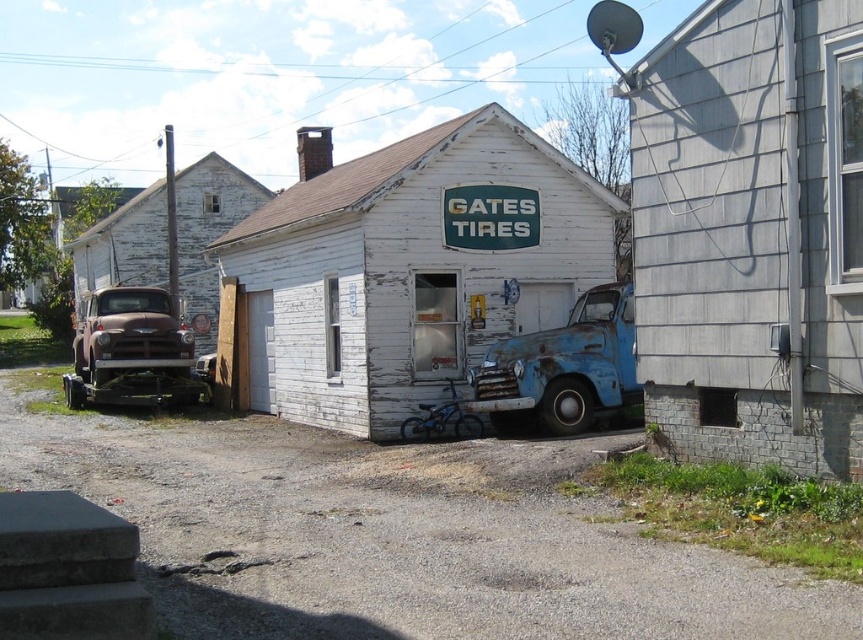
You are a delivery person trying to park your van in the driveway of the abandoned tire shop. The driveway can only accommodate vehicles smaller than the white weathered wood shed at center. Can your van, which is the same size as the rusty metal truck at center, fit in the driveway?

The white weathered wood shed at center is bigger than the rusty metal truck at center. Since your van is the same size as the rusty metal truck at center, it should fit in the driveway as the driveway can accommodate vehicles smaller than the shed.

You are a contractor assessing the property. You need to place a new storage container that must be wider than the rusty metal truck at left. Can the white weathered wood shed at center serve as a reference for the minimum width required?

The white weathered wood shed at center is wider than the rusty metal truck at left, so it can serve as a reference for the minimum width required for the new storage container.

You are a contractor assessing the site for potential renovations. You need to determine if the white weathered wood shed at center can accommodate the rusty metal truck at center. Based on their sizes, can the shed house the truck?

The white weathered wood shed at center is wider than the rusty metal truck at center, so it can accommodate the truck inside.